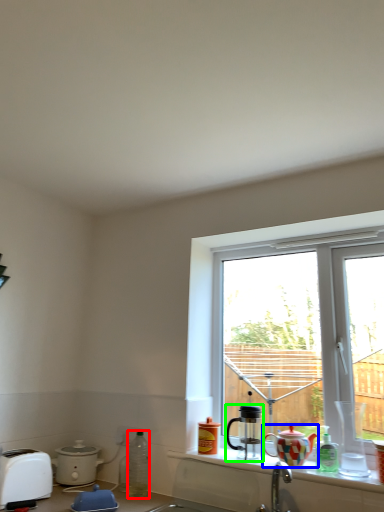
Question: Which object is the farthest from bottle (highlighted by a red box)? Choose among these: teapot (highlighted by a blue box) or coffee cup (highlighted by a green box).

Choices:
 (A) teapot
 (B) coffee cup

Answer: (A)